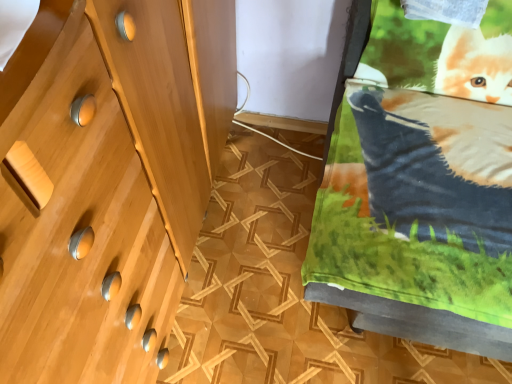
This screenshot has height=384, width=512. What are the coordinates of `matte wooden cabinet at lower right` in the screenshot? It's located at (420, 182).

What do you see at coordinates (420, 182) in the screenshot? Image resolution: width=512 pixels, height=384 pixels. I see `matte wooden cabinet at lower right` at bounding box center [420, 182].

Locate an element on the screen. matte wooden cabinet at lower right is located at coordinates (420, 182).